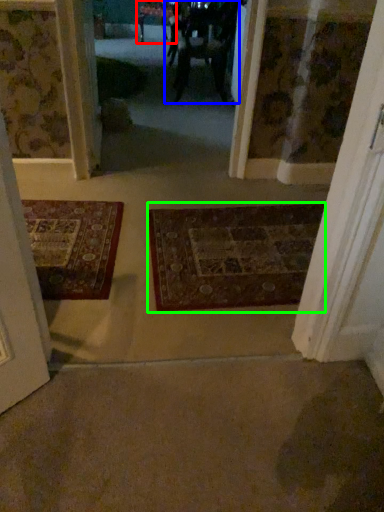
Question: Which object is the closest to the furniture (highlighted by a red box)? Choose among these: couple (highlighted by a blue box) or mat (highlighted by a green box).

Choices:
 (A) couple
 (B) mat

Answer: (A)